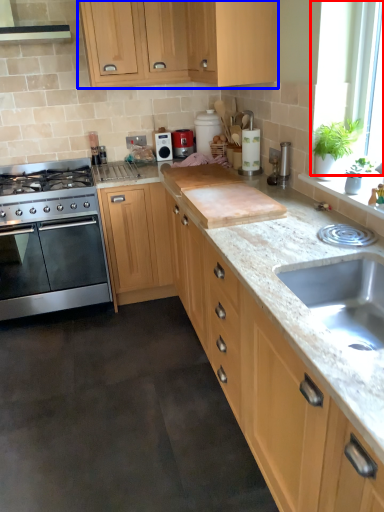
Question: Which object appears farthest to the camera in this image, window screen (highlighted by a red box) or cabinetry (highlighted by a blue box)?

Choices:
 (A) window screen
 (B) cabinetry

Answer: (B)